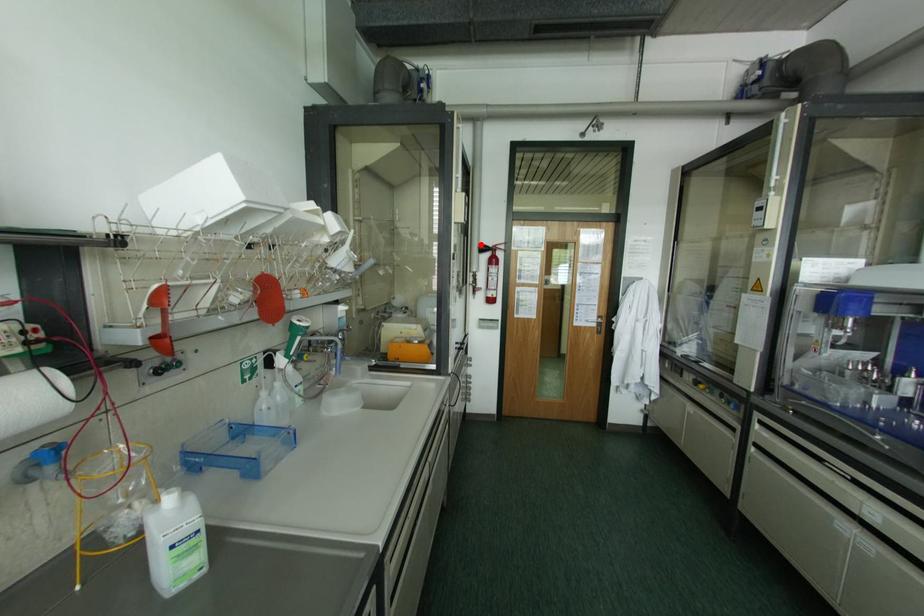
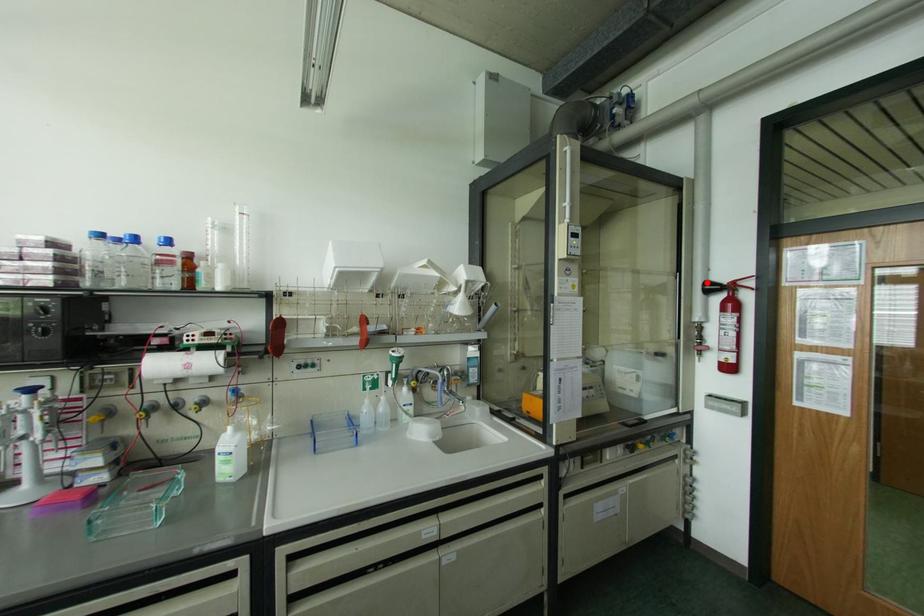
I am providing you with two images of the same scene from different viewpoints. A red point is marked on the first image and another point is marked on the second image. Is the red point in image1 aligned with the point shown in image2?

Yes